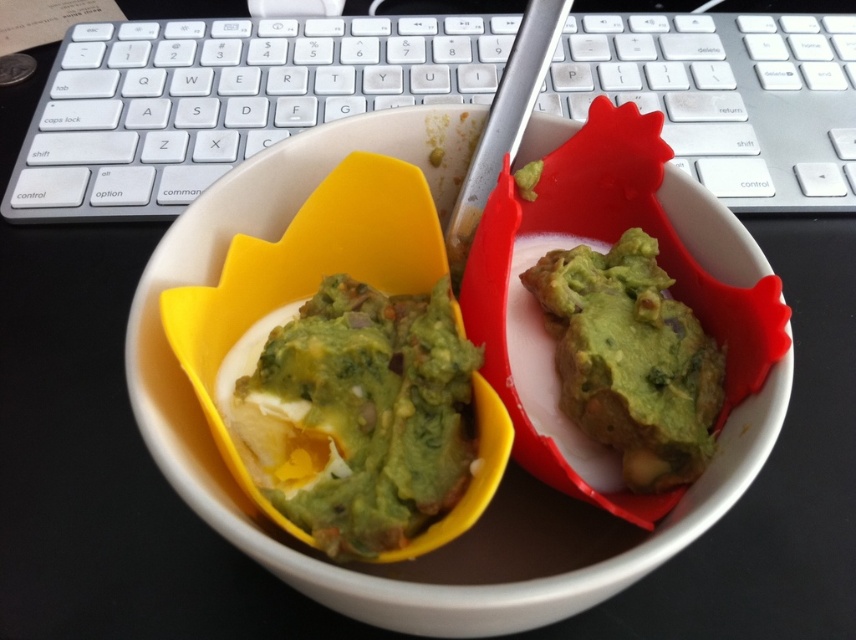
You are a GUI agent. You are given a task and a screenshot of the screen. Output one action in this format:
    pyautogui.click(x=<x>, y=<y>)
    Task: Click on the white matte bowl at center
    This screenshot has width=856, height=640.
    Given the screenshot: What is the action you would take?
    pyautogui.click(x=507, y=470)

Is point (527, 484) positioned after point (438, 499)?

That is True.

Who is more forward, (189, 268) or (474, 348)?

Positioned in front is point (474, 348).

Where is `white matte bowl at center`? This screenshot has height=640, width=856. white matte bowl at center is located at coordinates (507, 470).

Is green matte guacamole at center further to camera compared to green matte guacamole at right?

No, it is not.

Which is behind, point (361, 419) or point (663, 316)?

The point (663, 316) is behind.

Is point (304, 468) closer to viewer compared to point (667, 323)?

Yes.

Locate an element on the screen. green matte guacamole at center is located at coordinates (355, 413).

This screenshot has height=640, width=856. Find the location of `white matte bowl at center`. white matte bowl at center is located at coordinates (507, 470).

Does point (385, 113) come behind point (623, 285)?

Yes, point (385, 113) is behind point (623, 285).

Measure the distance between white matte bowl at center and camera.

white matte bowl at center and camera are 11.84 inches apart from each other.

Find the location of a particular element. Image resolution: width=856 pixels, height=640 pixels. white matte bowl at center is located at coordinates (507, 470).